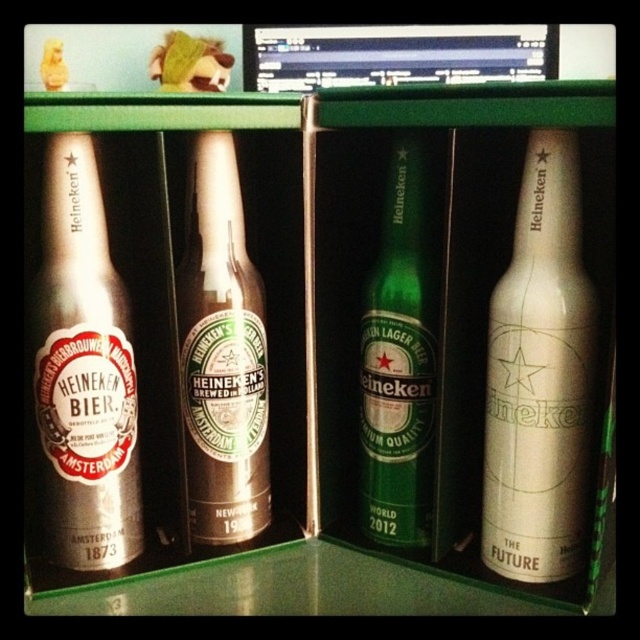
Who is higher up, green glass bottle at center or black glossy monitor at upper center?

Positioned higher is black glossy monitor at upper center.

From the picture: Can you confirm if green glass bottle at center is positioned to the left of black glossy monitor at upper center?

Yes, green glass bottle at center is to the left of black glossy monitor at upper center.

Which is in front, point (422, 291) or point (260, 70)?

Positioned in front is point (422, 291).

Identify the location of green glass bottle at center. This screenshot has height=640, width=640. (401, 353).

Can you confirm if metallic silver bottle at right is wider than black glossy monitor at upper center?

In fact, metallic silver bottle at right might be narrower than black glossy monitor at upper center.

Between metallic silver bottle at right and black glossy monitor at upper center, which one has less height?

Standing shorter between the two is black glossy monitor at upper center.

Describe the element at coordinates (540, 376) in the screenshot. I see `metallic silver bottle at right` at that location.

Image resolution: width=640 pixels, height=640 pixels. Identify the location of metallic silver bottle at right. (540, 376).

Who is more forward, (262, 410) or (426, 346)?

Point (426, 346) is more forward.

I want to click on brown glass bottle at center, so [221, 355].

Is point (260, 456) more distant than point (406, 372)?

Yes, point (260, 456) is behind point (406, 372).

Where is `brown glass bottle at center`? The width and height of the screenshot is (640, 640). brown glass bottle at center is located at coordinates (221, 355).